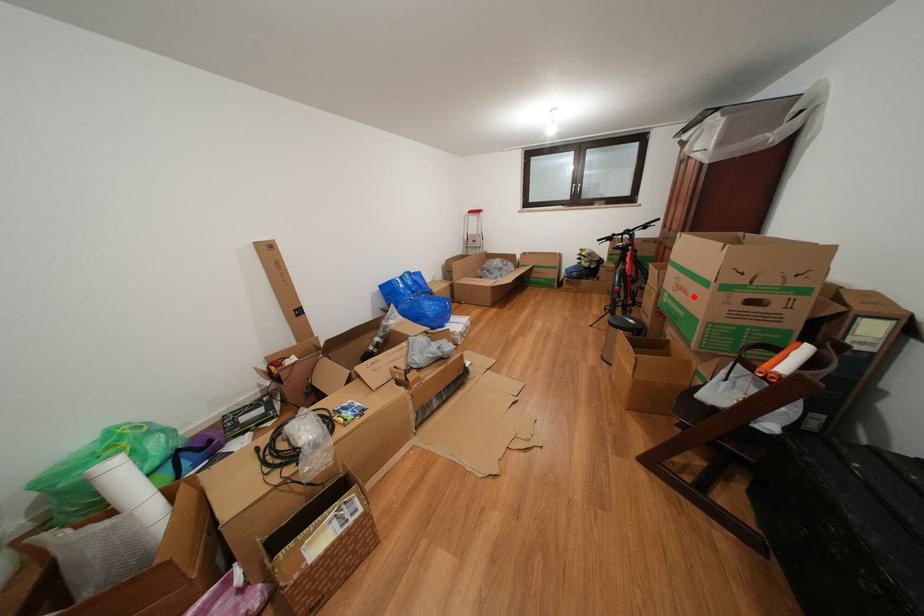
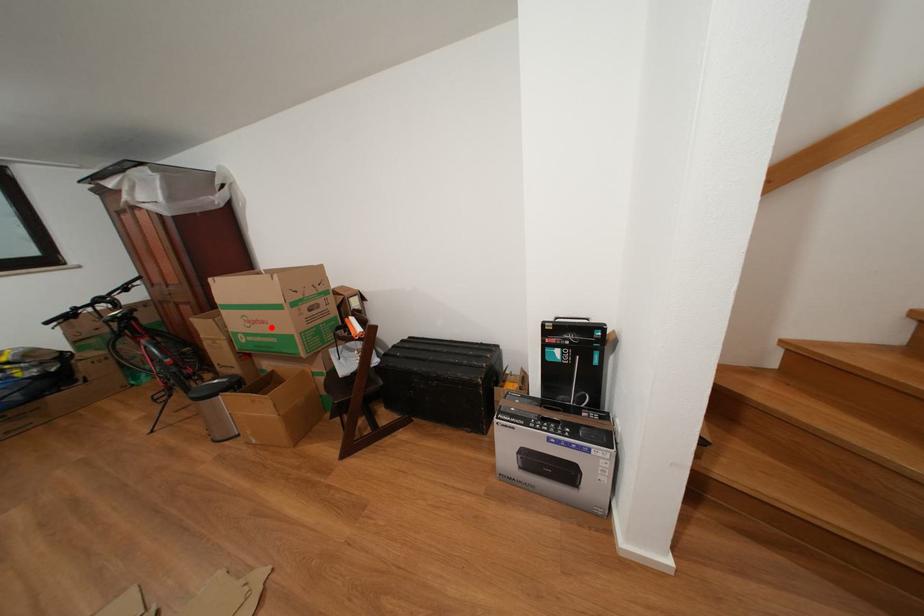
I am providing you with two images of the same scene from different viewpoints. A red point is marked on the first image and another point is marked on the second image. Do the highlighted points in image1 and image2 indicate the same real-world spot?

Yes